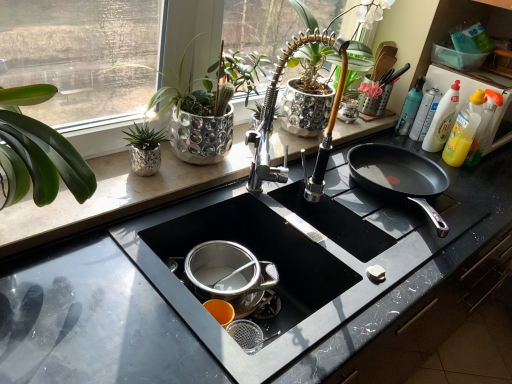
Locate an element on the screen. This screenshot has height=384, width=512. free space in front of green glossy plant at upper left, placed as the first houseplant when sorted from left to right is located at coordinates (121, 198).